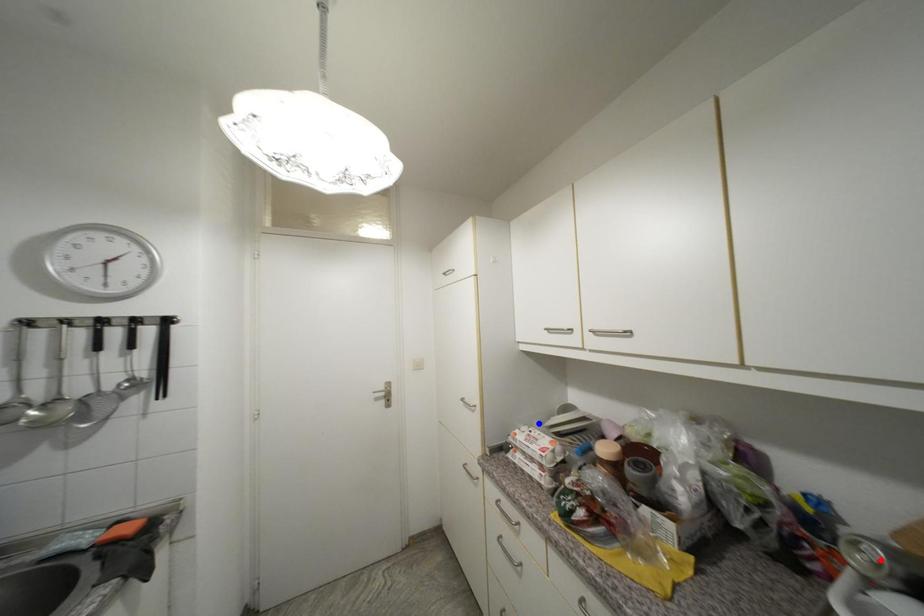
Question: Two points are marked on the image. Which point is closer to the camera?

Choices:
 (A) Blue point is closer.
 (B) Red point is closer.

Answer: (B)